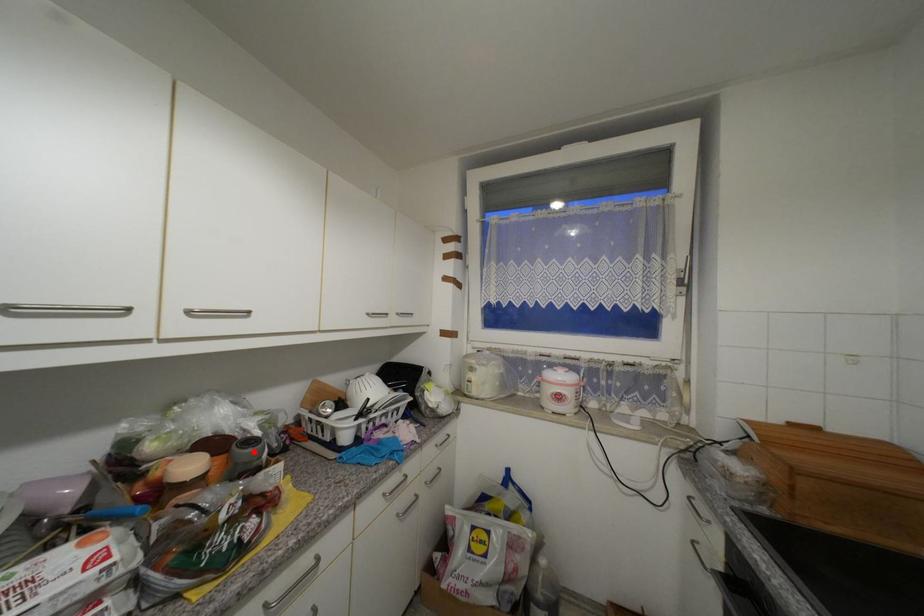
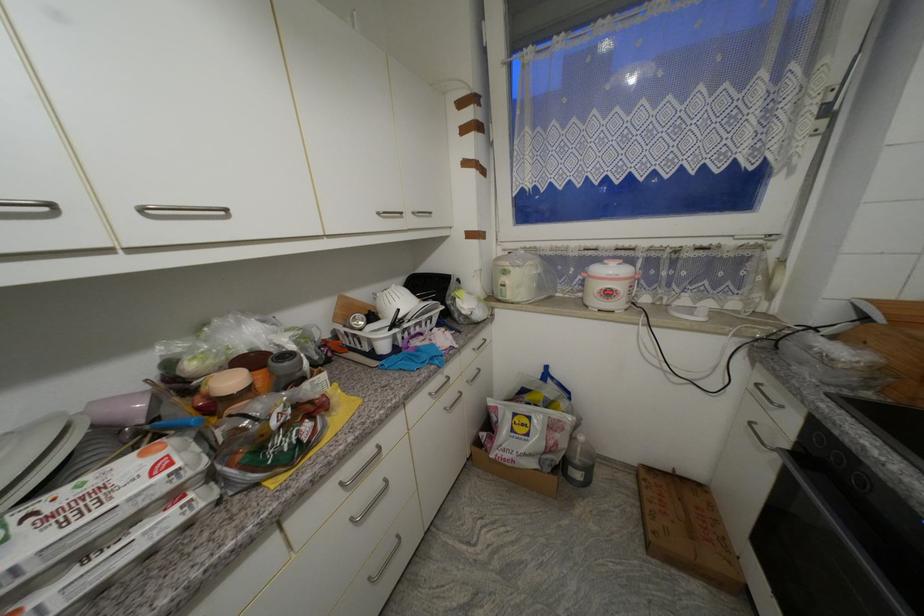
In the second image, find the point that corresponds to the highlighted location in the first image.

(292, 365)